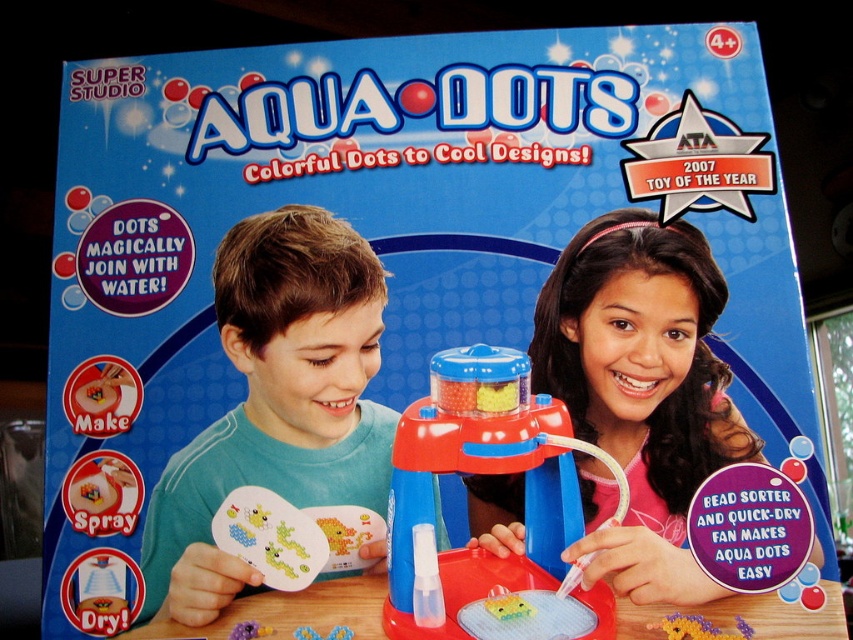
Question: Is pink fabric hairband at upper center to the right of purple matte beads at center from the viewer's perspective?

Choices:
 (A) no
 (B) yes

Answer: (B)

Question: Is matte teal shirt at center above blue plastic bead sorter at center?

Choices:
 (A) yes
 (B) no

Answer: (A)

Question: Which point is farther to the camera?

Choices:
 (A) (401, 572)
 (B) (256, 632)
 (C) (689, 280)
 (D) (308, 353)

Answer: (C)

Question: Can you confirm if pink fabric hairband at upper center is bigger than matte teal shirt at center?

Choices:
 (A) no
 (B) yes

Answer: (B)

Question: Among these points, which one is nearest to the camera?

Choices:
 (A) (231, 634)
 (B) (686, 406)
 (C) (456, 445)
 (D) (228, 568)

Answer: (C)

Question: Among these objects, which one is farthest from the camera?

Choices:
 (A) pink fabric hairband at upper center
 (B) blue plastic bead sorter at center

Answer: (A)